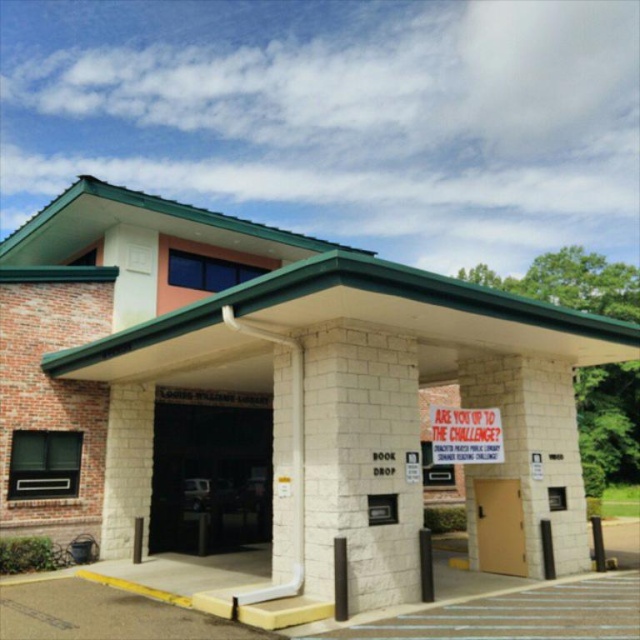
You are a library visitor holding a book to return. You see the white stone book drop at center and the brown matte door at center. Which object is closer to you as you approach the library entrance?

The white stone book drop at center is closer to you because it is in front of the brown matte door at center.

You are a delivery person carrying a large package that is 1.2 meters wide. You arrive at the Louis Williams Library and need to enter through the entrance. The entrance has a brick wall entrance at center and a brown matte door at center. Can your package fit through the entrance? Please explain your reasoning based on the width of the entrance and the door.

The brick wall entrance at center might be wider than the brown matte door at center. Since the package is 1.2 meters wide, if the entrance is wider than the door, the package could potentially fit through the entrance area, but the exact width of the entrance isn not specified. However, the door itself might be narrower than the entrance. To ensure safe passage, measure the entrance width or check if the door can accommodate the package.

You are standing in front of the Louis Williams Library and need to locate the entrance. You see the white brick building at center and the brick wall entrance at center. Which one is closer to your left side?

The brick wall entrance at center is closer to your left side because the white brick building at center is positioned to its right.